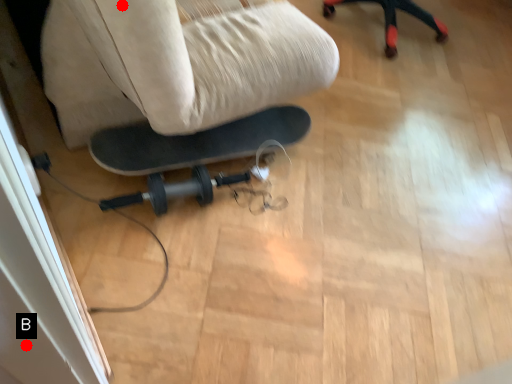
Question: Two points are circled on the image, labeled by A and B beside each circle. Which point appears farthest from the camera in this image?

Choices:
 (A) A is further
 (B) B is further

Answer: (A)